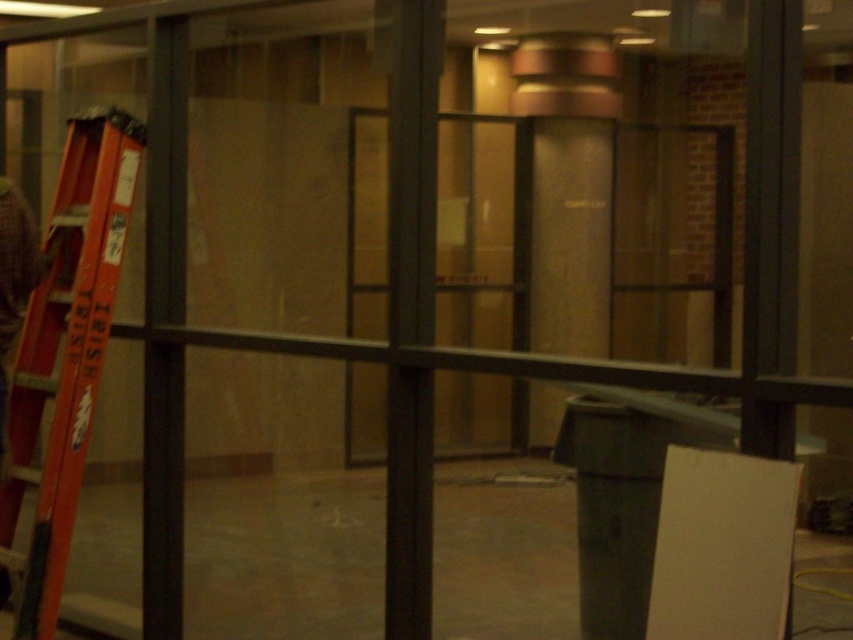
Question: Which of the following is the farthest from the observer?

Choices:
 (A) orange metallic ladder at left
 (B) black metal pole at center

Answer: (A)

Question: Does orange metallic ladder at left have a larger size compared to black metal pole at center?

Choices:
 (A) yes
 (B) no

Answer: (A)

Question: Among these objects, which one is nearest to the camera?

Choices:
 (A) black metal pole at center
 (B) orange metallic ladder at left

Answer: (A)

Question: Considering the relative positions of orange metallic ladder at left and black metal pole at center in the image provided, where is orange metallic ladder at left located with respect to black metal pole at center?

Choices:
 (A) right
 (B) left

Answer: (B)

Question: Can you confirm if orange metallic ladder at left is positioned to the right of black metal pole at center?

Choices:
 (A) no
 (B) yes

Answer: (A)